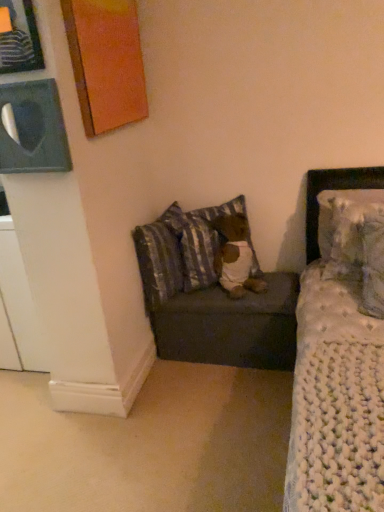
Where is `unoccupied region to the right of brown plush bear at center`? The width and height of the screenshot is (384, 512). unoccupied region to the right of brown plush bear at center is located at coordinates (279, 283).